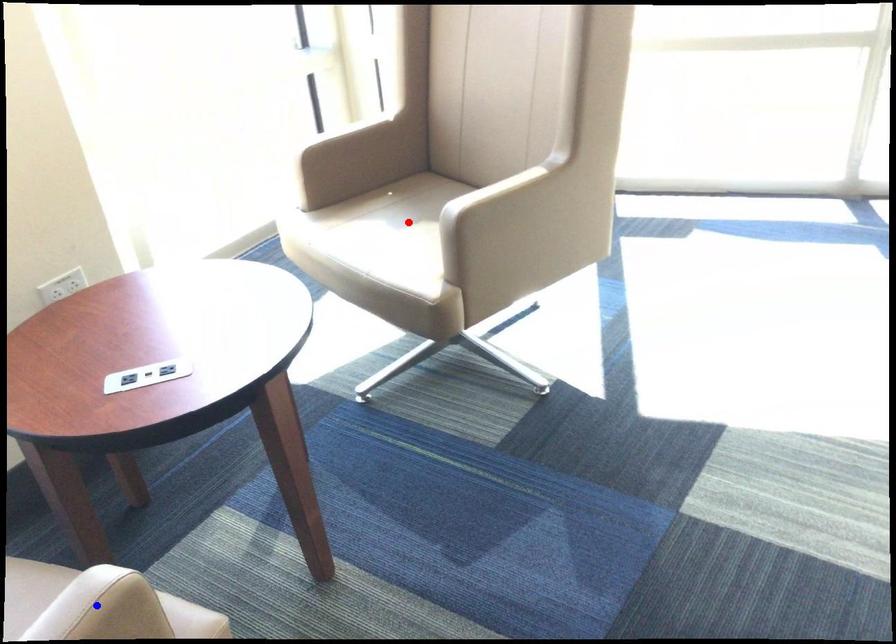
Question: Which of the two points in the image is closer to the camera?

Choices:
 (A) Blue point is closer.
 (B) Red point is closer.

Answer: (A)